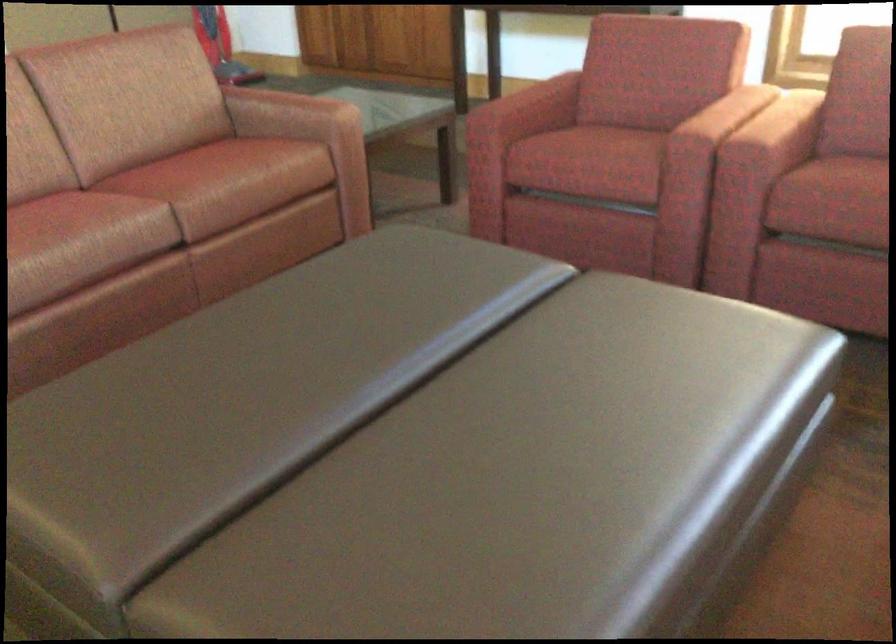
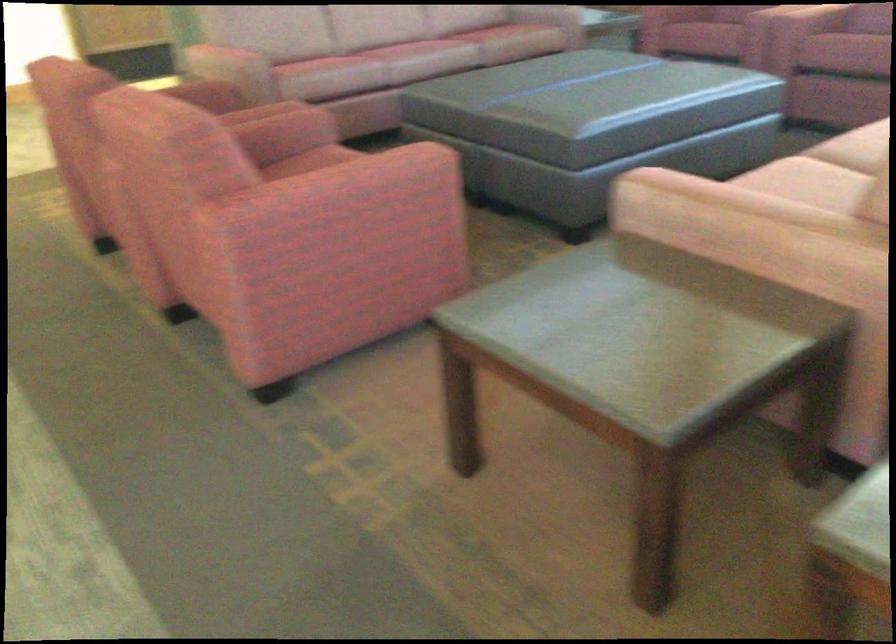
Question: In a continuous first-person perspective shot, in which direction is the camera moving?

Choices:
 (A) Left
 (B) Right
 (C) Forward
 (D) Backward

Answer: (D)